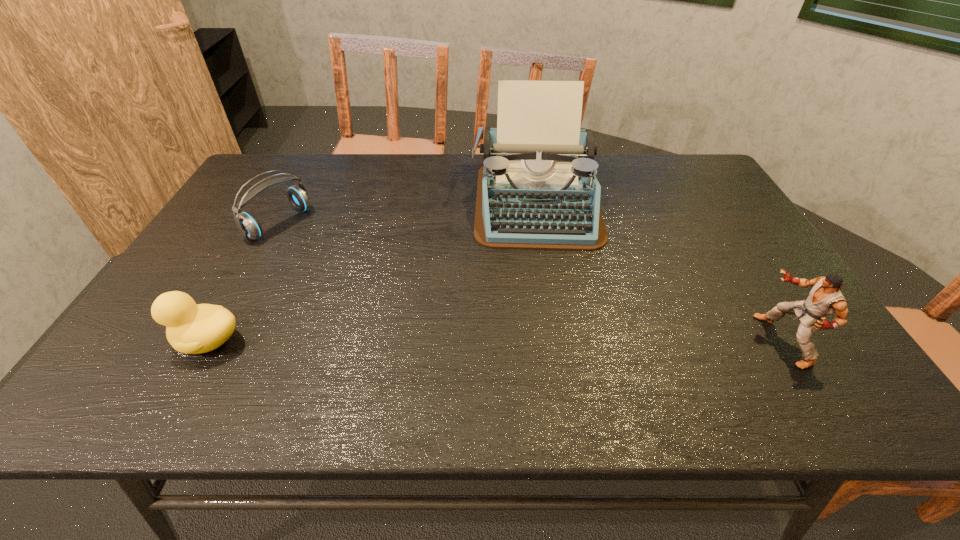
The height and width of the screenshot is (540, 960). Find the location of `free spot on the desktop that is between the duck and the puncher and is positioned on the ear cups of the headset`. free spot on the desktop that is between the duck and the puncher and is positioned on the ear cups of the headset is located at coordinates (479, 341).

Locate an element on the screen. Image resolution: width=960 pixels, height=540 pixels. vacant spot on the desktop that is between the duck and the second tallest object and is positioned on the typing side of the tallest object is located at coordinates (549, 341).